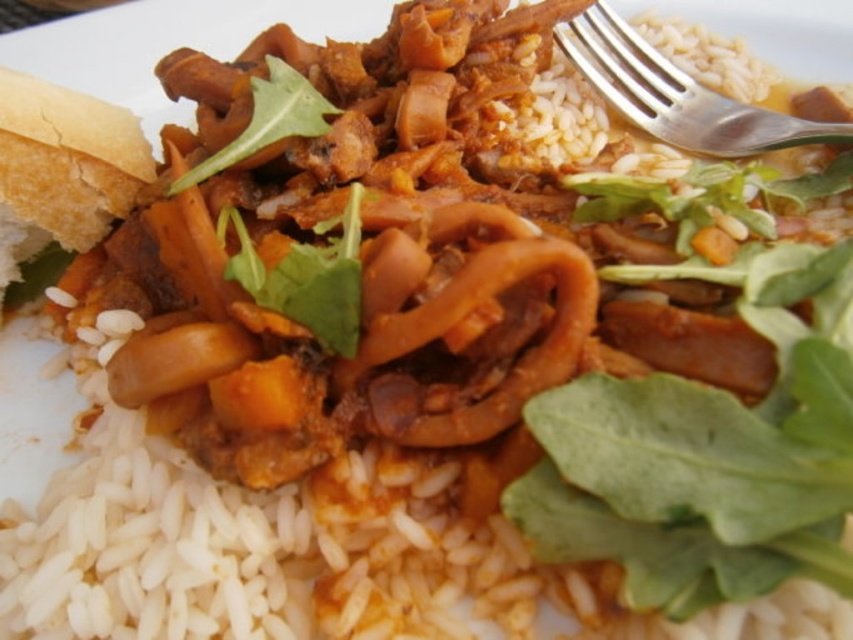
What do you see at coordinates (306, 276) in the screenshot? I see `green leafy vegetable at center` at bounding box center [306, 276].

You are a GUI agent. You are given a task and a screenshot of the screen. Output one action in this format:
    pyautogui.click(x=<x>, y=<y>)
    Task: Click on the green leafy vegetable at center
    
    Given the screenshot: What is the action you would take?
    pyautogui.click(x=306, y=276)

What are the coordinates of `silver metallic fork at upper right` in the screenshot? It's located at (676, 93).

Is point (795, 131) less distant than point (271, 100)?

No.

Image resolution: width=853 pixels, height=640 pixels. What do you see at coordinates (676, 93) in the screenshot?
I see `silver metallic fork at upper right` at bounding box center [676, 93].

Find the location of a particular element. silver metallic fork at upper right is located at coordinates (676, 93).

Does point (730, 122) lie in front of point (318, 312)?

That is False.

Does silver metallic fork at upper right lie in front of green leafy vegetable at center?

No, silver metallic fork at upper right is further to the viewer.

Who is more forward, [648,106] or [248,280]?

Point [248,280] is more forward.

The image size is (853, 640). What are the coordinates of `silver metallic fork at upper right` in the screenshot? It's located at [x=676, y=93].